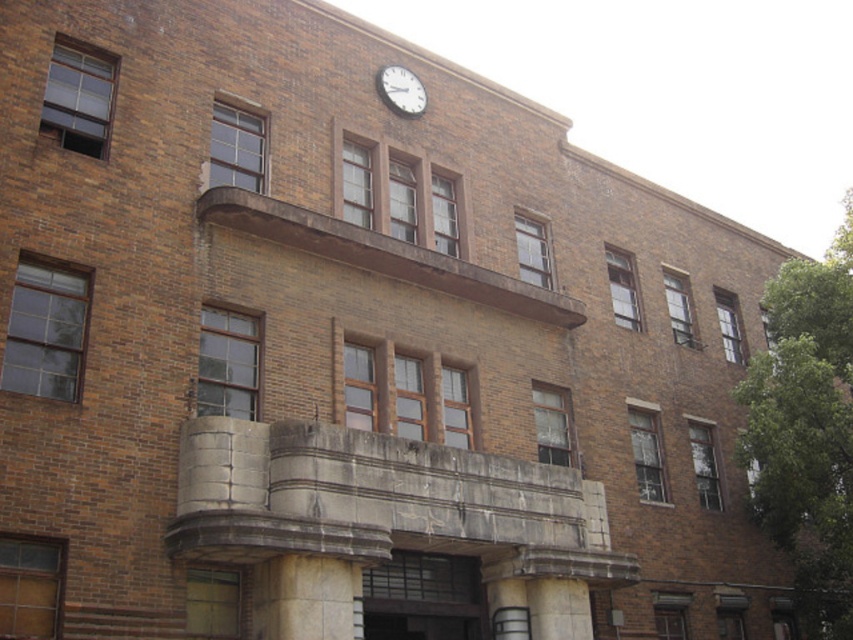
Looking at this image, you are standing at the base of the building and want to know the distance between the white marble pillar at center and the white matte clock at upper center. Can you estimate how far apart they are?

The white marble pillar at center is 84.27 feet away from the white matte clock at upper center.

You are standing at the base of the building and want to know the distance between the white concrete pillar at center and the white matte clock at upper center. Can you estimate how far apart they are?

The white concrete pillar at center is 24.91 meters away from the white matte clock at upper center.